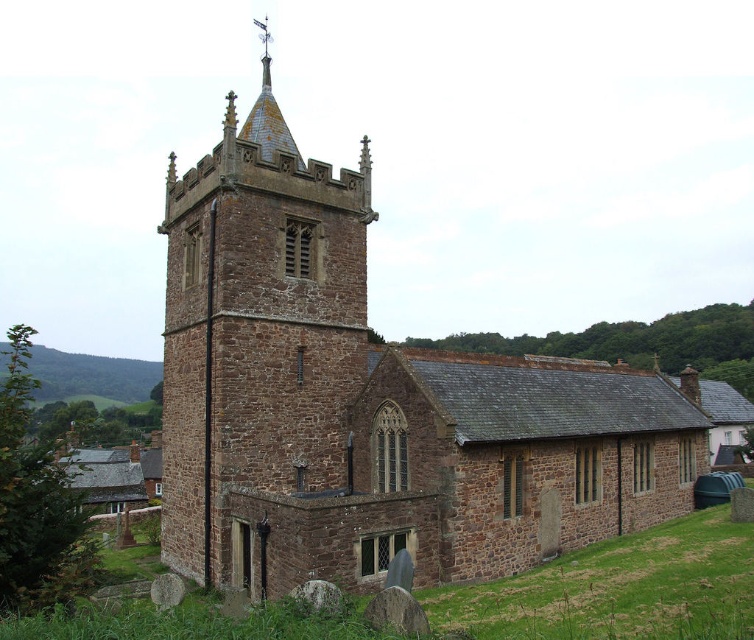
Question: Does brown stone tower at center-left have a greater width compared to brown grassy at lower right?

Choices:
 (A) yes
 (B) no

Answer: (B)

Question: Which is nearer to the brown stone church at center?

Choices:
 (A) brown grassy at lower right
 (B) brown stone tower at center-left

Answer: (B)

Question: From the image, what is the correct spatial relationship of brown stone church at center in relation to brown stone tower at center-left?

Choices:
 (A) below
 (B) above

Answer: (A)

Question: Among these objects, which one is nearest to the camera?

Choices:
 (A) brown grassy at lower right
 (B) brown stone tower at center-left

Answer: (A)

Question: Is the position of brown stone church at center more distant than that of brown stone tower at center-left?

Choices:
 (A) no
 (B) yes

Answer: (B)

Question: Which object is farther from the camera taking this photo?

Choices:
 (A) brown stone church at center
 (B) brown stone tower at center-left
 (C) brown grassy at lower right

Answer: (A)